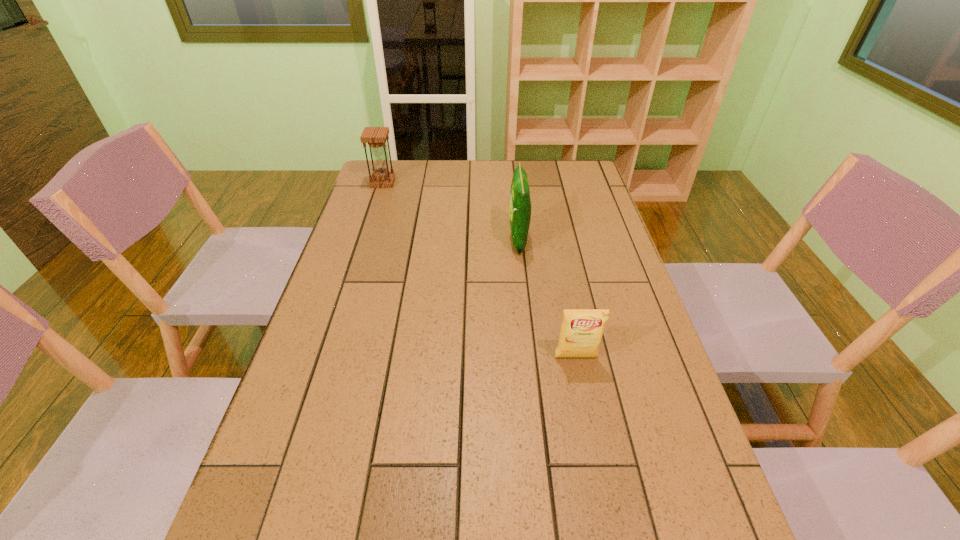
Where is `vacant area situated 0.370m on the front of the rightmost object with the logo`? The image size is (960, 540). vacant area situated 0.370m on the front of the rightmost object with the logo is located at coordinates (612, 539).

Where is `object located in the far edge section of the desktop`? object located in the far edge section of the desktop is located at coordinates (376, 137).

At what (x,y) coordinates should I click in order to perform the action: click on object situated at the left edge. Please return your answer as a coordinate pair (x, y). The width and height of the screenshot is (960, 540). Looking at the image, I should click on (376, 137).

At what (x,y) coordinates should I click in order to perform the action: click on object positioned at the right edge. Please return your answer as a coordinate pair (x, y). Looking at the image, I should click on (581, 332).

Identify the location of object that is positioned at the far left corner. This screenshot has width=960, height=540. (376, 137).

In order to click on vacant space at the far edge of the desktop in this screenshot , I will do `click(532, 174)`.

Find the location of a particular element. Image resolution: width=960 pixels, height=540 pixels. vacant space at the left edge of the desktop is located at coordinates (321, 298).

I want to click on vacant space at the right edge of the desktop, so pyautogui.click(x=629, y=503).

Identify the location of free space between the right crisp (potato chip) and the farther crisp (potato chip). (547, 299).

What are the coordinates of `vacant point located between the right crisp (potato chip) and the second shortest object` in the screenshot? It's located at (479, 270).